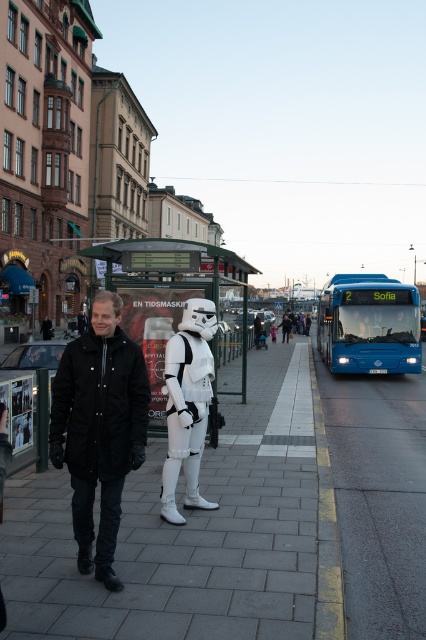
Question: Is black matte jacket at center below white plastic bus stop at center?

Choices:
 (A) yes
 (B) no

Answer: (A)

Question: Is black matte jacket at center positioned before blue metallic bus at center?

Choices:
 (A) yes
 (B) no

Answer: (A)

Question: Based on their relative distances, which object is farther from the smooth asphalt road at center?

Choices:
 (A) white plastic bus stop at center
 (B) white matte stormtrooper at center
 (C) black matte jacket at center
 (D) blue metallic bus at center

Answer: (C)

Question: Which point is farther to the camera?

Choices:
 (A) white matte stormtrooper at center
 (B) smooth asphalt road at center
 (C) smooth concrete sidewalk at center

Answer: (A)

Question: Is white plastic bus stop at center above white matte stormtrooper at center?

Choices:
 (A) yes
 (B) no

Answer: (A)

Question: Which point is closer to the camera?

Choices:
 (A) (370, 529)
 (B) (233, 392)
 (C) (203, 372)
 (D) (172, 531)

Answer: (D)